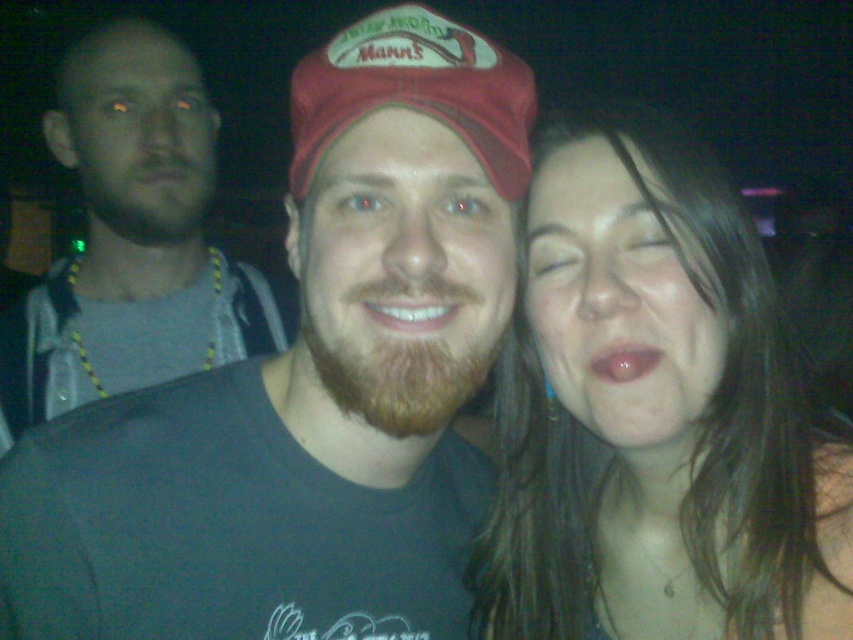
You are taking a photo of the scene described. The matte skin face at upper left is at point 0.211, 0.161. If you want to center your camera on this face, which direction should you move the camera? Please answer with either left, right, up, or down.

The matte skin face at upper left is located at coordinates 0.211 on the x and 0.161 on the y. Since the center of the image is at 0.5 on both axes, you should move the camera to the right and down to center it.

You are a photographer trying to focus on the matte skin face at upper left and the white glossy teeth at center. Which one is closer to the camera?

The matte skin face at upper left is closer to the camera than the white glossy teeth at center because the white glossy teeth at center is behind it.